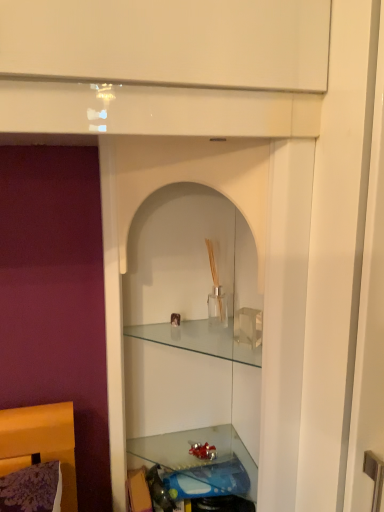
Question: Considering the relative positions of translucent glass shelf at lower center and clear glass cabinet at center, marked as the second cabinet in a top-to-bottom arrangement, in the image provided, is translucent glass shelf at lower center to the left of clear glass cabinet at center, marked as the second cabinet in a top-to-bottom arrangement, from the viewer's perspective?

Choices:
 (A) yes
 (B) no

Answer: (B)

Question: Considering the relative sizes of translucent glass shelf at lower center and clear glass cabinet at center, marked as the second cabinet in a top-to-bottom arrangement, in the image provided, is translucent glass shelf at lower center bigger than clear glass cabinet at center, marked as the second cabinet in a top-to-bottom arrangement,?

Choices:
 (A) no
 (B) yes

Answer: (A)

Question: Is translucent glass shelf at lower center thinner than clear glass cabinet at center, marked as the 1th cabinet in a bottom-to-top arrangement?

Choices:
 (A) no
 (B) yes

Answer: (B)

Question: From the image's perspective, is translucent glass shelf at lower center below clear glass cabinet at center, marked as the second cabinet in a top-to-bottom arrangement?

Choices:
 (A) yes
 (B) no

Answer: (A)

Question: Is translucent glass shelf at lower center next to clear glass cabinet at center, marked as the second cabinet in a top-to-bottom arrangement, and touching it?

Choices:
 (A) yes
 (B) no

Answer: (B)

Question: Is point (148, 153) closer or farther from the camera than point (233, 431)?

Choices:
 (A) closer
 (B) farther

Answer: (A)

Question: In terms of height, does clear glass cabinet at center, marked as the second cabinet in a top-to-bottom arrangement, look taller or shorter compared to translucent glass shelf at lower center?

Choices:
 (A) short
 (B) tall

Answer: (B)

Question: From a real-world perspective, is clear glass cabinet at center, marked as the second cabinet in a top-to-bottom arrangement, positioned above or below translucent glass shelf at lower center?

Choices:
 (A) below
 (B) above

Answer: (B)

Question: Looking at their shapes, would you say clear glass cabinet at center, marked as the second cabinet in a top-to-bottom arrangement, is wider or thinner than translucent glass shelf at lower center?

Choices:
 (A) thin
 (B) wide

Answer: (B)

Question: From the image's perspective, is clear glass vase at center, which ranks as the second cabinet in bottom-to-top order, above or below translucent glass shelf at lower center?

Choices:
 (A) below
 (B) above

Answer: (B)

Question: Do you think clear glass vase at center, the first cabinet viewed from the top, is within translucent glass shelf at lower center, or outside of it?

Choices:
 (A) inside
 (B) outside

Answer: (B)

Question: Considering the relative positions of clear glass vase at center, the first cabinet viewed from the top, and translucent glass shelf at lower center in the image provided, is clear glass vase at center, the first cabinet viewed from the top, to the left or to the right of translucent glass shelf at lower center?

Choices:
 (A) left
 (B) right

Answer: (B)

Question: From their relative heights in the image, would you say clear glass vase at center, the first cabinet viewed from the top, is taller or shorter than translucent glass shelf at lower center?

Choices:
 (A) short
 (B) tall

Answer: (B)

Question: Is clear glass cabinet at center, marked as the second cabinet in a top-to-bottom arrangement, in front of or behind clear glass vase at center, the first cabinet viewed from the top, in the image?

Choices:
 (A) front
 (B) behind

Answer: (A)

Question: Does point (124, 137) appear closer or farther from the camera than point (253, 353)?

Choices:
 (A) closer
 (B) farther

Answer: (A)